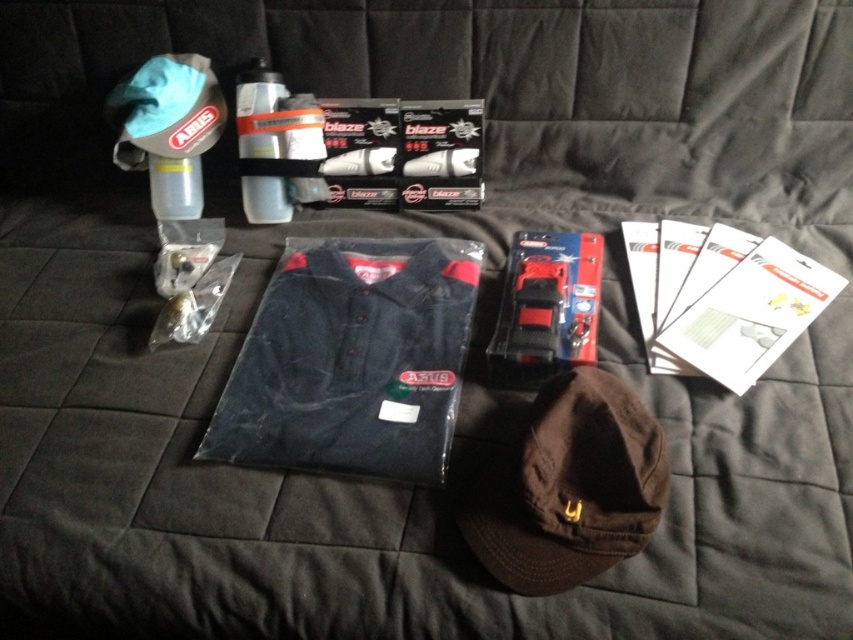
You are organizing a cycling event and need to pack items into a backpack. The brown cotton cap at center and the matte gray water bottle at upper left are among the items. Which item will occupy more space in the backpack?

The brown cotton cap at center is larger in size than the matte gray water bottle at upper left, so it will occupy more space in the backpack.

You are organizing items on a table and need to place a new item between the white paper at upper right and the matte gray water bottle at upper left. Which side should the new item be placed closer to, the white paper or the water bottle, based on their sizes?

The white paper at upper right is wider than the matte gray water bottle at upper left, so the new item should be placed closer to the matte gray water bottle at upper left to maintain balance between the two items.